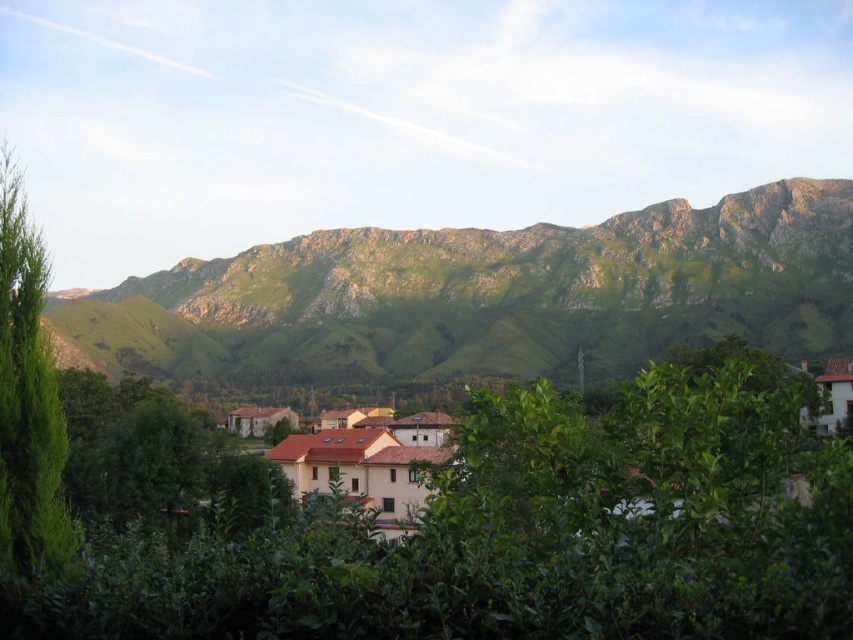
Question: Which of the following is the farthest from the observer?

Choices:
 (A) green leafy tree at left
 (B) green rocky mountain range at upper center

Answer: (B)

Question: Is green rocky mountain range at upper center below green leafy tree at left?

Choices:
 (A) yes
 (B) no

Answer: (B)

Question: Which point appears farthest from the camera in this image?

Choices:
 (A) (329, 262)
 (B) (299, 456)
 (C) (16, 266)

Answer: (A)

Question: Does green rocky mountain range at upper center have a lesser width compared to brown tiled houses at center?

Choices:
 (A) yes
 (B) no

Answer: (B)

Question: Which of the following is the closest to the observer?

Choices:
 (A) green rocky mountain range at upper center
 (B) green leafy tree at left
 (C) brown tiled houses at center

Answer: (C)

Question: In this image, where is green rocky mountain range at upper center located relative to brown tiled houses at center?

Choices:
 (A) below
 (B) above

Answer: (B)